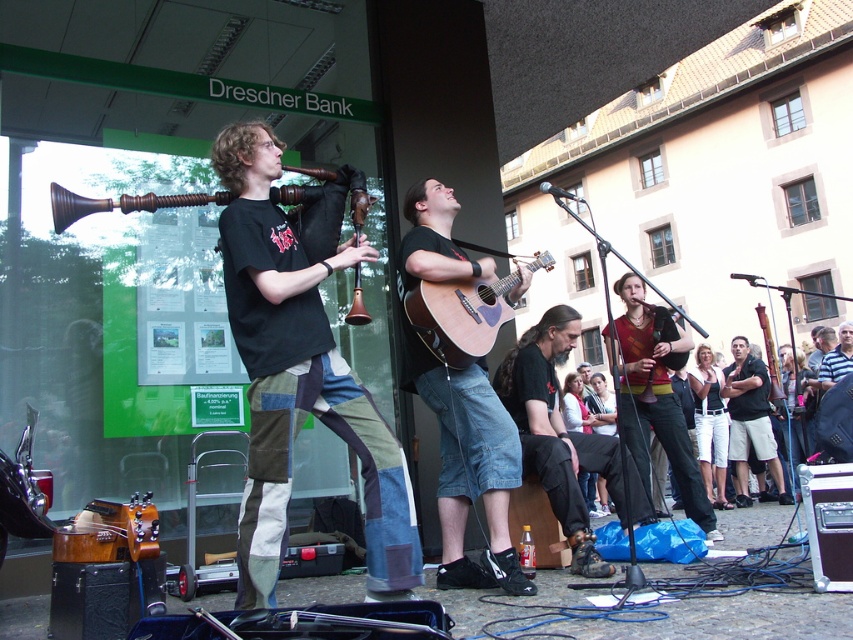
You are a photographer standing at the edge of the performance area. You want to take a photo that includes both the dark brown leather shoes at lower center and the black cotton shirt at center. Given that your camera has a maximum focus range of 3 meters, will you be able to capture both in focus without moving your position?

The dark brown leather shoes at lower center and black cotton shirt at center are 3.84 meters apart. Since the distance between them exceeds the camera maximum focus range of 3 meters, you will not be able to capture both in focus without moving your position.

From the picture: You are a photographer trying to capture the street performance. You notice two pairs of shorts at the lower right corner of your frame. Which one is positioned to the left between the white cotton shorts at lower right and the denim shorts at lower right?

The white cotton shorts at lower right are positioned to the left of the denim shorts at lower right.